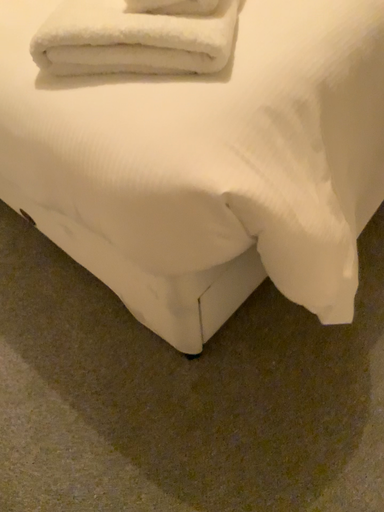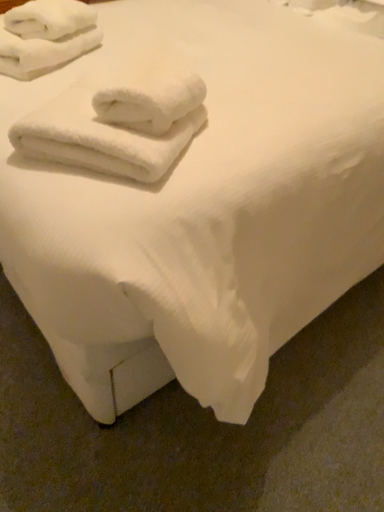
Question: How did the camera likely rotate when shooting the video?

Choices:
 (A) rotated upward
 (B) rotated downward

Answer: (A)